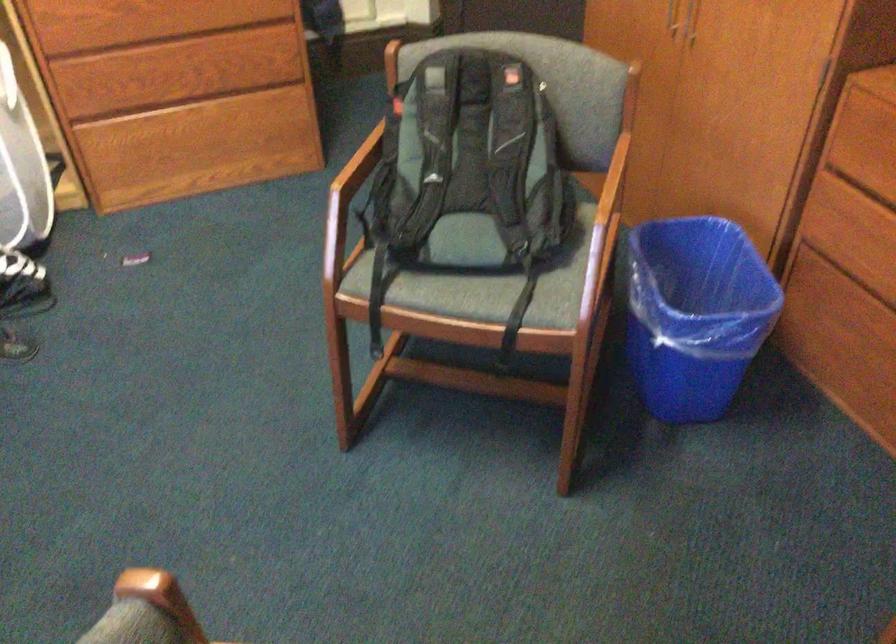
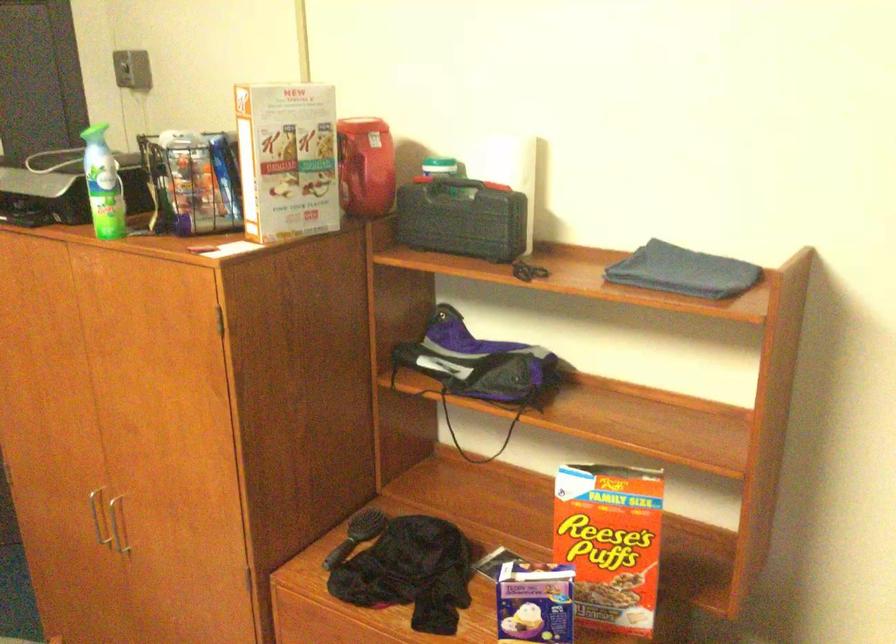
The first image is from the beginning of the video and the second image is from the end. How did the camera likely rotate when shooting the video?

The camera rotated toward right-up.